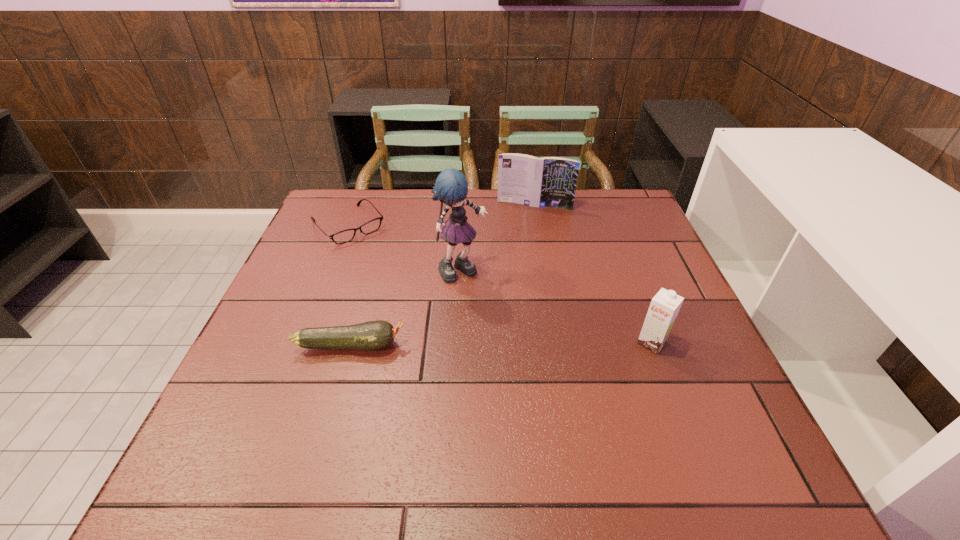
This screenshot has width=960, height=540. In order to click on blank area located on the front-facing side of the shortest object in this screenshot , I will do `click(382, 261)`.

Identify the location of vacant point located on the front cover of the book. This screenshot has width=960, height=540. (509, 282).

Where is `vacant space located on the front cover of the book`? This screenshot has width=960, height=540. vacant space located on the front cover of the book is located at coordinates (517, 249).

This screenshot has height=540, width=960. I want to click on free space located on the front cover of the book, so click(523, 225).

The width and height of the screenshot is (960, 540). What are the coordinates of `free space located on the front-facing side of the third object from right to left` in the screenshot? It's located at tap(520, 318).

Locate an element on the screen. The image size is (960, 540). vacant area situated 0.110m on the front-facing side of the third object from right to left is located at coordinates (507, 306).

Locate an element on the screen. free space located on the front-facing side of the third object from right to left is located at coordinates (493, 294).

Locate an element on the screen. Image resolution: width=960 pixels, height=540 pixels. spectacles located in the far edge section of the desktop is located at coordinates (373, 225).

This screenshot has height=540, width=960. What are the coordinates of `book located in the far edge section of the desktop` in the screenshot? It's located at (550, 181).

Identify the location of zucchini at the left edge. This screenshot has height=540, width=960. (373, 335).